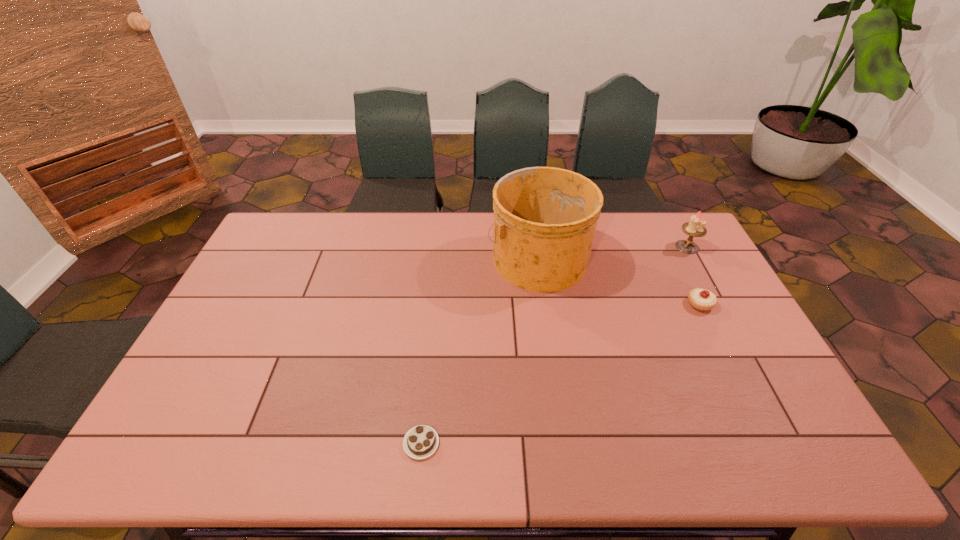
Identify the location of vacant space located 0.340m on the right of the leftmost object. (582, 443).

The height and width of the screenshot is (540, 960). I want to click on bucket situated at the far edge, so click(545, 218).

I want to click on candle holder located at the far edge, so click(x=694, y=228).

You are a GUI agent. You are given a task and a screenshot of the screen. Output one action in this format:
    pyautogui.click(x=<x>, y=<y>)
    Task: Click on the object present at the near edge
    
    Given the screenshot: What is the action you would take?
    pyautogui.click(x=420, y=442)

Where is `candle holder located at the right edge`? candle holder located at the right edge is located at coordinates (694, 228).

In order to click on pastry present at the right edge in this screenshot , I will do `click(700, 299)`.

What are the coordinates of `object that is at the far right corner` in the screenshot? It's located at (694, 228).

I want to click on vacant area at the far edge, so click(399, 213).

Find the location of a particular element. free space at the near edge of the desktop is located at coordinates (618, 459).

This screenshot has height=540, width=960. In the image, there is a desktop. What are the coordinates of `vacant region at the left edge` in the screenshot? It's located at (173, 424).